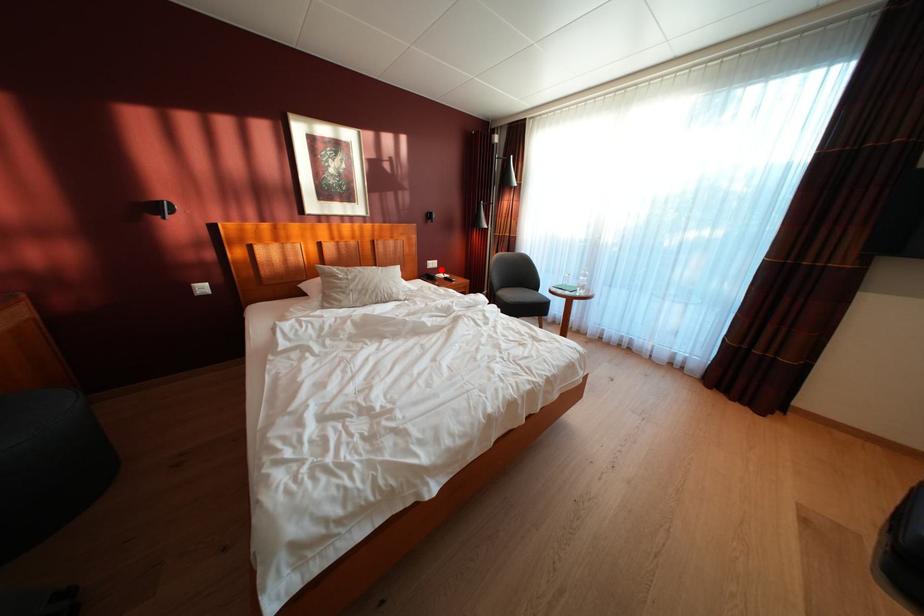
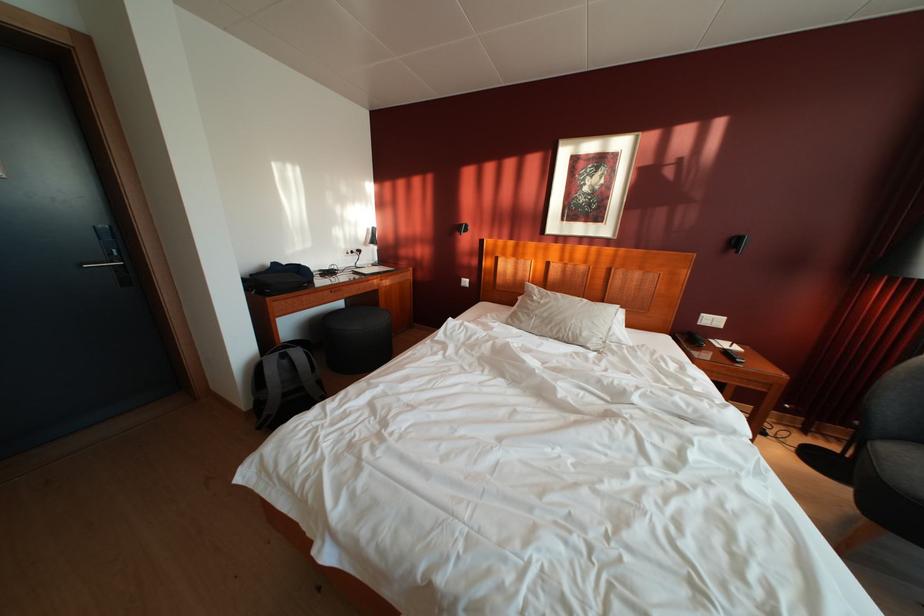
Question: I am providing you with two images of the same scene from different viewpoints. Given a red point in image1, look at the same physical point in image2. Is it:

Choices:
 (A) Closer to the viewpoint
 (B) Farther from the viewpoint

Answer: (B)